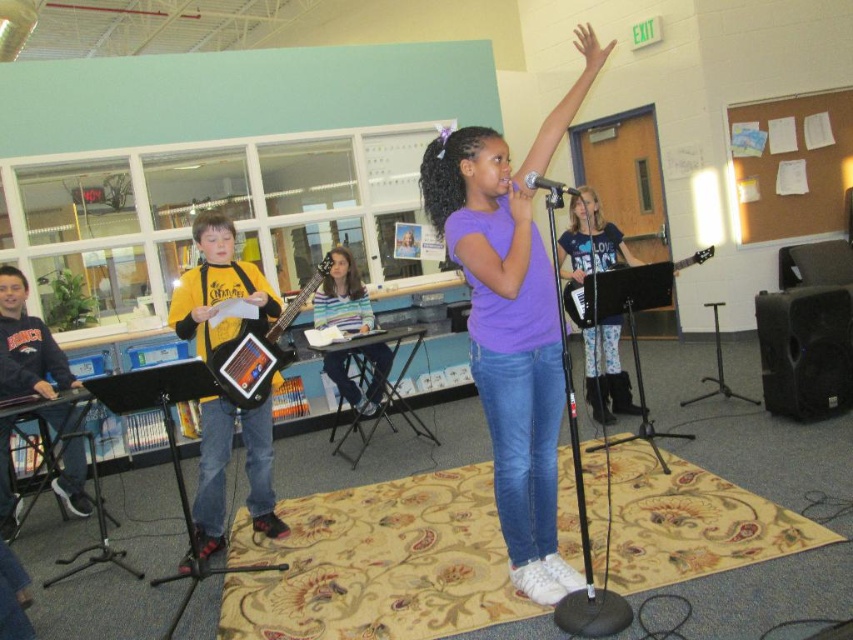
Image resolution: width=853 pixels, height=640 pixels. Describe the element at coordinates (512, 321) in the screenshot. I see `purple matte shirt at center` at that location.

Does point (451, 227) come closer to viewer compared to point (200, 218)?

Yes, it is.

The width and height of the screenshot is (853, 640). What are the coordinates of `purple matte shirt at center` in the screenshot? It's located at (512, 321).

The image size is (853, 640). What are the coordinates of `purple matte shirt at center` in the screenshot? It's located at (512, 321).

Consider the image. Can you confirm if yellow jersey at left is shorter than brushed metal keyboard at left?

In fact, yellow jersey at left may be taller than brushed metal keyboard at left.

Which is in front, point (248, 413) or point (78, 394)?

Point (248, 413)

Between point (206, 464) and point (42, 403), which one is positioned behind?

Positioned behind is point (42, 403).

Identify the location of yellow jersey at left. The image size is (853, 640). (216, 285).

Which of these two, striped fabric shirt at center or wooden electric guitar at center, stands taller?

With more height is striped fabric shirt at center.

Looking at this image, can you confirm if striped fabric shirt at center is positioned to the left of wooden electric guitar at center?

In fact, striped fabric shirt at center is to the right of wooden electric guitar at center.

This screenshot has height=640, width=853. Identify the location of striped fabric shirt at center. (341, 296).